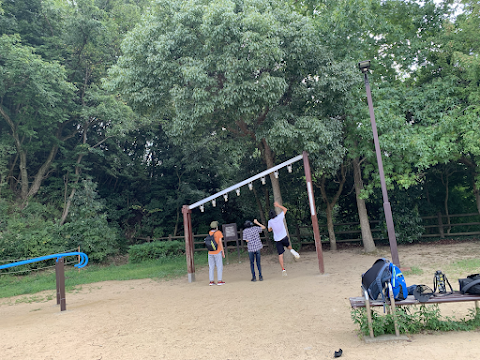
Image resolution: width=480 pixels, height=360 pixels. In order to click on bench in this screenshot , I will do `click(461, 300)`.